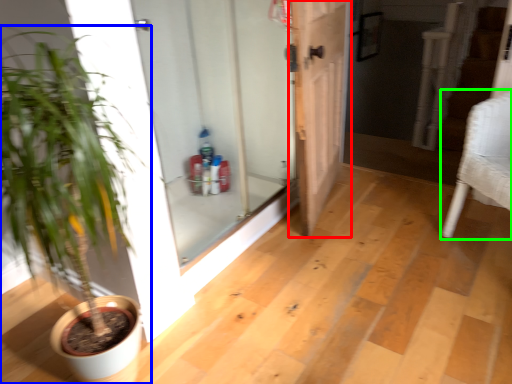
Question: Considering the real-world distances, which object is closest to door (highlighted by a red box)? houseplant (highlighted by a blue box) or armchair (highlighted by a green box).

Choices:
 (A) houseplant
 (B) armchair

Answer: (B)